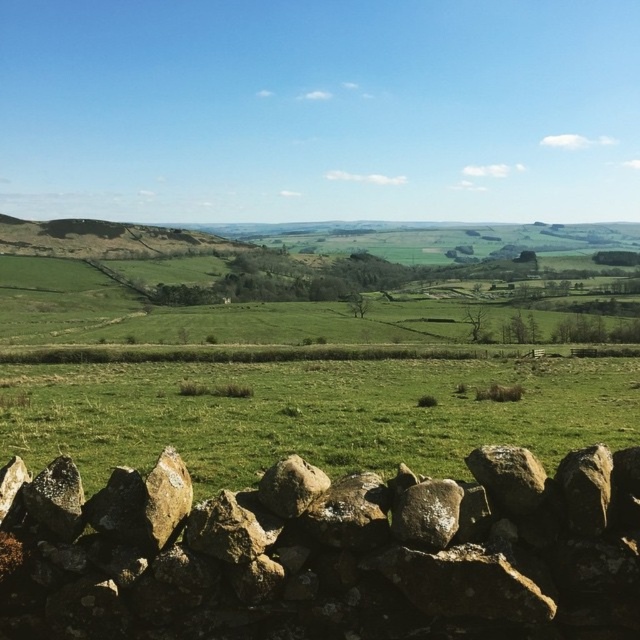
You are standing at the center of the dry stone wall in the image. You want to place a small flag exactly at the position of the brown rough stone at lower center. What are the coordinates where you should place the flag?

The coordinates for the brown rough stone at lower center are at point (x=326, y=554), so you should place the flag there.

You are standing in the middle of the dry stone wall in the foreground of the rural landscape. You notice two points marked on the wall. The first point is at coordinates point (x=428, y=435), and the second point is at point (x=317, y=472). Which point is closer to your current position?

Point (x=428, y=435) is further to the camera than point (x=317, y=472), so the second point at point (x=317, y=472) is closer to your current position on the wall.

You are a small robot with a width of 12 inches. You need to move from the brown rough stone at lower center to the rusty metallic rock at center. Can you fit through the space between them?

The distance between the brown rough stone at lower center and the rusty metallic rock at center is 27.63 inches, which is wider than the robot width of 12 inches. Therefore, the robot can fit through the space between them.